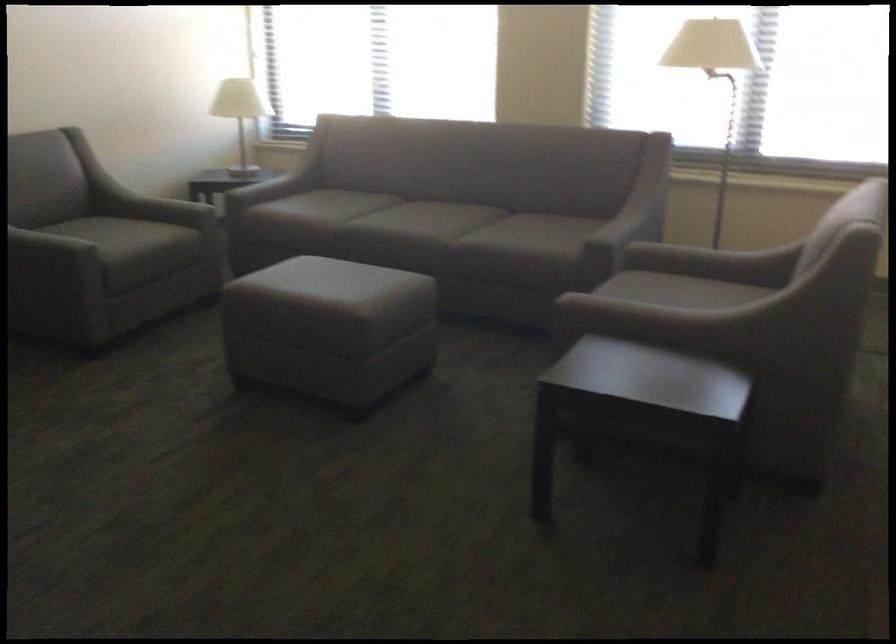
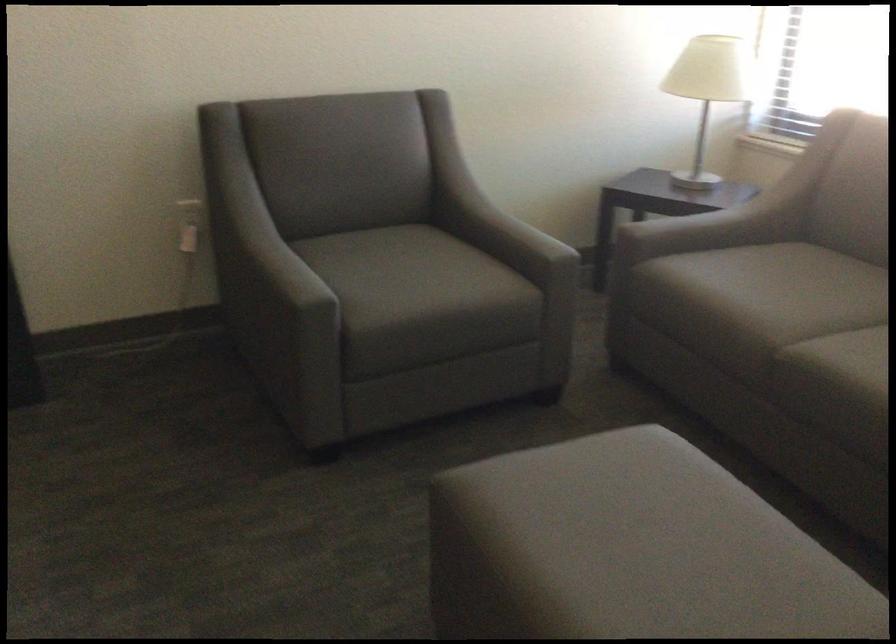
Where in the second image is the point corresponding to (168,202) from the first image?

(509, 234)